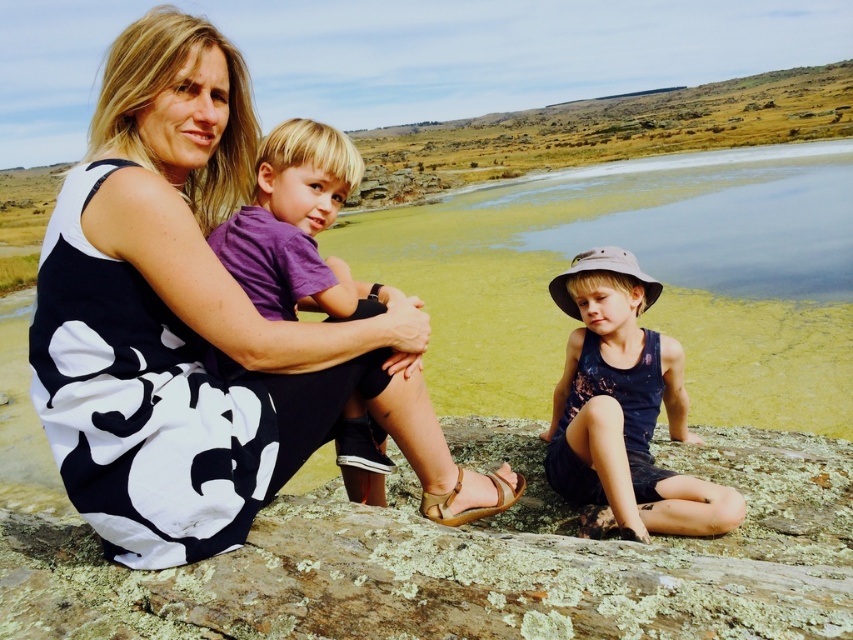
Question: Is black floral dress at center bigger than purple cotton shirt at center?

Choices:
 (A) yes
 (B) no

Answer: (A)

Question: Among these objects, which one is farthest from the camera?

Choices:
 (A) dark blue tank top at center
 (B) lichen-covered rock at center
 (C) black floral dress at center
 (D) purple cotton shirt at center

Answer: (A)

Question: Which point is farther to the camera?

Choices:
 (A) (625, 483)
 (B) (300, 390)
 (C) (32, 627)
 (D) (241, 260)

Answer: (A)

Question: Which object is closer to the camera taking this photo?

Choices:
 (A) dark blue tank top at center
 (B) purple cotton shirt at center

Answer: (B)

Question: Where is lichen-covered rock at center located in relation to dark blue tank top at center in the image?

Choices:
 (A) right
 (B) left

Answer: (B)

Question: Is black floral dress at center in front of dark blue tank top at center?

Choices:
 (A) yes
 (B) no

Answer: (A)